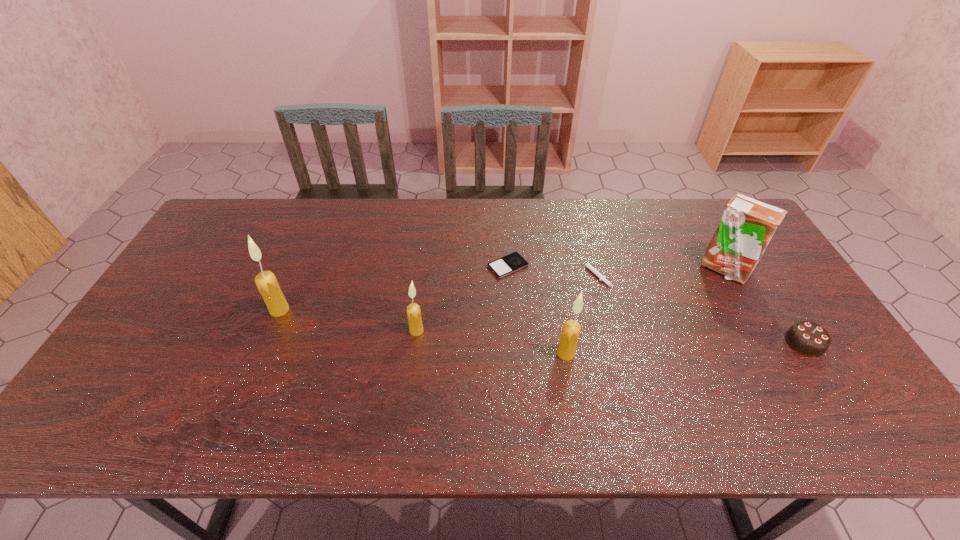
I want to click on free point between the leftmost object and the sixth tallest object, so click(x=437, y=292).

Where is `empty space between the third shortest object and the carton`? empty space between the third shortest object and the carton is located at coordinates (764, 306).

At what (x,y) coordinates should I click in order to perform the action: click on vacant area that lies between the syringe and the shortest candle. Please return your answer as a coordinate pair (x, y). Looking at the image, I should click on (506, 302).

The height and width of the screenshot is (540, 960). In order to click on free space between the fourth object from left to right and the chocolate cake in this screenshot , I will do `click(685, 348)`.

Identify the location of blank region between the third object from right to left and the carton. (660, 271).

Select which object appears as the third closest to the syringe. Please provide its 2D coordinates. Your answer should be formatted as a tuple, i.e. [(x, y)], where the tuple contains the x and y coordinates of a point satisfying the conditions above.

[(747, 225)]

Find the location of a particular element. The image size is (960, 540). object that is the sixth nearest to the second candle from left to right is located at coordinates (807, 338).

This screenshot has width=960, height=540. Find the location of `the closest candle relative to the sixth tallest object`. the closest candle relative to the sixth tallest object is located at coordinates (571, 329).

The height and width of the screenshot is (540, 960). Identify the location of candle that is the third nearest to the third object from left to right. (267, 284).

I want to click on vacant space that satisfies the following two spatial constraints: 1. on the back side of the second shortest object; 2. on the left side of the fourth tallest object, so click(424, 273).